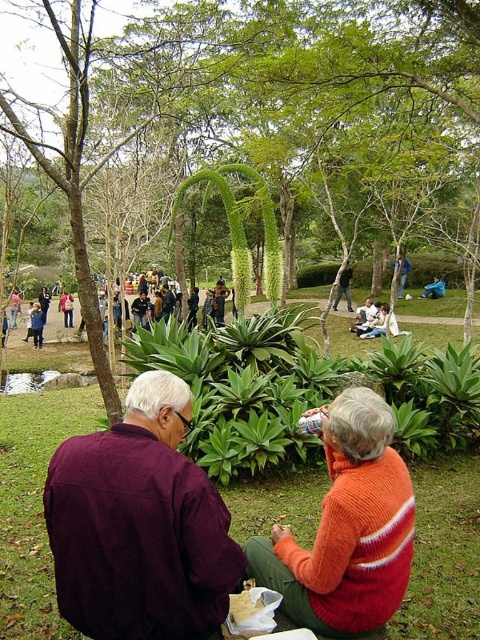
Question: Based on their relative distances, which object is nearer to the maroon fabric shirt at center?

Choices:
 (A) orange knitted sweater at center
 (B) green leafy plants at center
 (C) blue fabric bag at center
 (D) orange knitted sweater at lower right

Answer: (D)

Question: Among these points, which one is nearest to the camera?

Choices:
 (A) (191, 625)
 (B) (342, 275)
 (C) (450, 477)

Answer: (A)

Question: In this image, where is green leafy tree at center located relative to orange knitted sweater at lower right?

Choices:
 (A) below
 (B) above

Answer: (B)

Question: Which of the following is the closest to the observer?

Choices:
 (A) orange knitted sweater at lower right
 (B) smooth brown wooden stick at center
 (C) green leafy tree at center

Answer: (A)

Question: Considering the relative positions of green leafy tree at center and orange knitted sweater at center in the image provided, where is green leafy tree at center located with respect to orange knitted sweater at center?

Choices:
 (A) right
 (B) left

Answer: (B)

Question: Does orange knitted sweater at lower right appear under blue fabric bag at center?

Choices:
 (A) yes
 (B) no

Answer: (A)